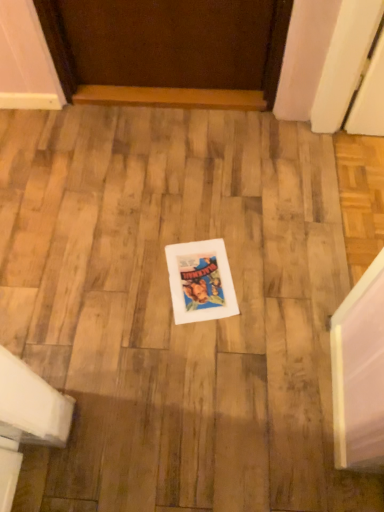
Find the location of a particular element. free space to the left of matte paper comic book at center is located at coordinates (137, 282).